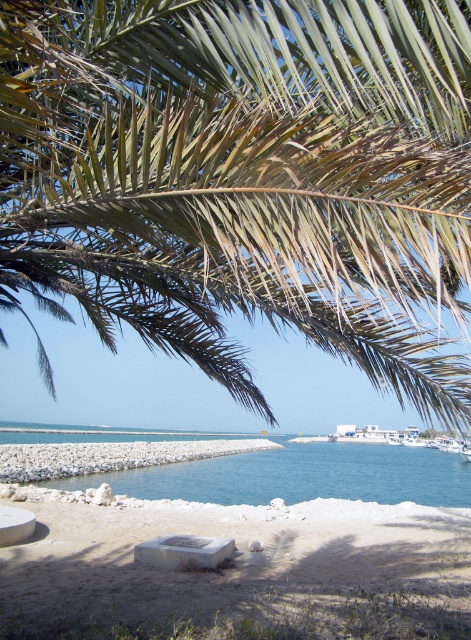
Question: Is white sand at lower center further to the viewer compared to blue water at center?

Choices:
 (A) yes
 (B) no

Answer: (B)

Question: Which is nearer to the white sand at lower center?

Choices:
 (A) green leafy palm tree at upper center
 (B) blue water at center

Answer: (A)

Question: Which point is closer to the camera?

Choices:
 (A) (433, 298)
 (B) (367, 540)
 (C) (254, 464)

Answer: (A)

Question: Which object is positioned closest to the blue water at center?

Choices:
 (A) green leafy palm tree at upper center
 (B) white sand at lower center

Answer: (A)

Question: Is green leafy palm tree at upper center thinner than white sand at lower center?

Choices:
 (A) yes
 (B) no

Answer: (B)

Question: Is green leafy palm tree at upper center behind white sand at lower center?

Choices:
 (A) no
 (B) yes

Answer: (A)